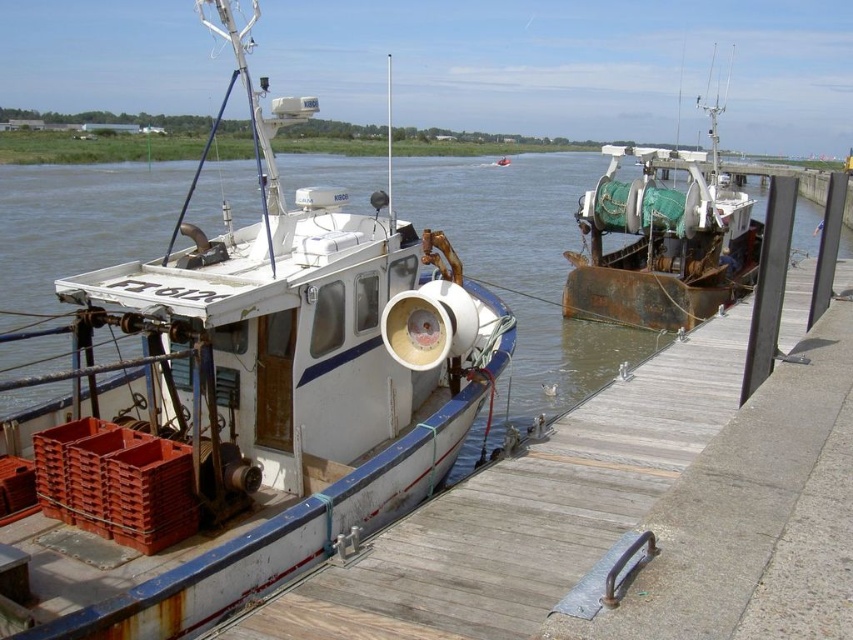
Question: Is the position of white matte boat at center less distant than that of wooden at left?

Choices:
 (A) yes
 (B) no

Answer: (A)

Question: Considering the real-world distances, which object is closest to the wooden at left?

Choices:
 (A) white matte boat at center
 (B) rusty metal boat at right

Answer: (A)

Question: Does white matte boat at center have a larger size compared to rusty metal boat at right?

Choices:
 (A) yes
 (B) no

Answer: (B)

Question: Estimate the real-world distances between objects in this image. Which object is closer to the white matte boat at center?

Choices:
 (A) rusty metal boat at right
 (B) wooden at left

Answer: (B)

Question: Which object appears closest to the camera in this image?

Choices:
 (A) rusty metal boat at right
 (B) white matte boat at center
 (C) wooden at left

Answer: (B)

Question: Can you confirm if wooden at left is positioned to the left of rusty metal boat at right?

Choices:
 (A) no
 (B) yes

Answer: (B)